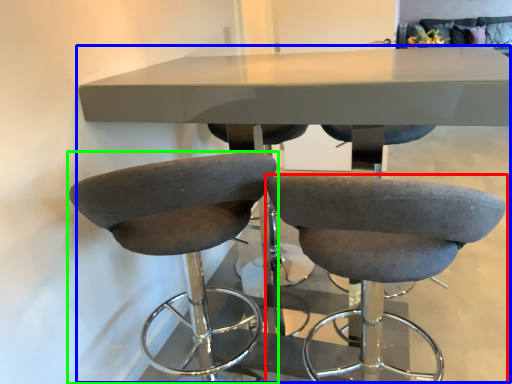
Question: Which is farther away from chair (highlighted by a red box)? table (highlighted by a blue box) or chair (highlighted by a green box)?

Choices:
 (A) table
 (B) chair

Answer: (A)